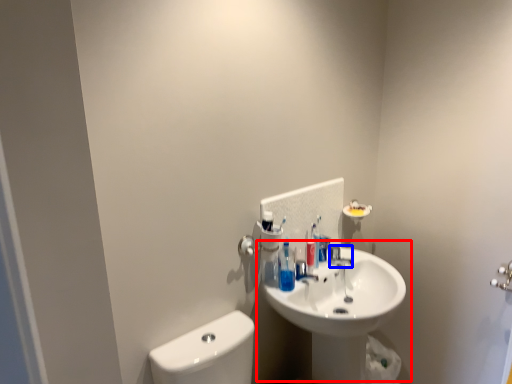
Question: Which object appears closest to the camera in this image, sink (highlighted by a red box) or plumbing fixture (highlighted by a blue box)?

Choices:
 (A) sink
 (B) plumbing fixture

Answer: (A)